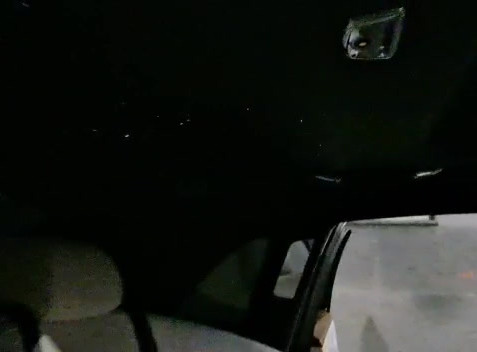
Image resolution: width=477 pixels, height=352 pixels. What are the coordinates of `sill` in the screenshot? It's located at (426, 218).